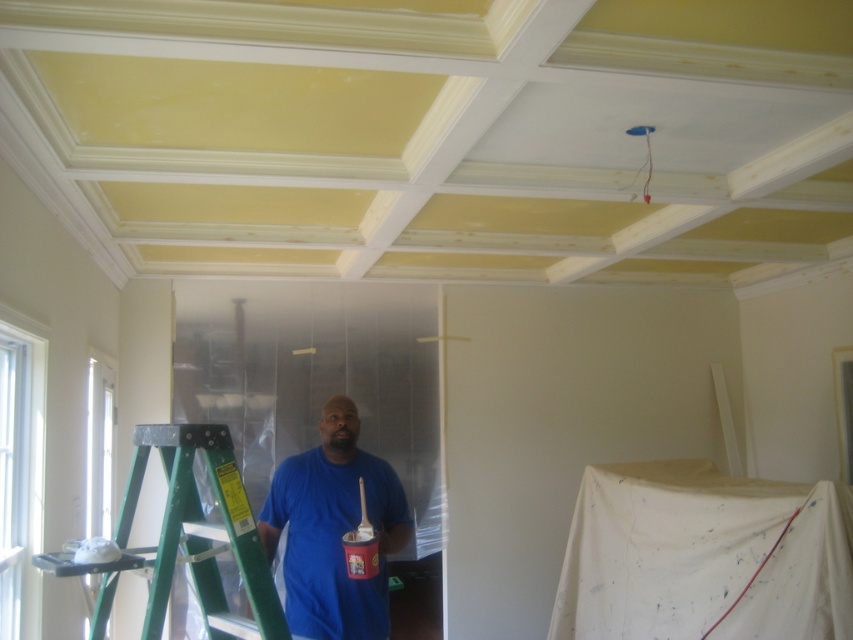
Is blue cotton shirt at center to the left of green metallic ladder at center from the viewer's perspective?

In fact, blue cotton shirt at center is to the right of green metallic ladder at center.

Which is behind, point (335, 634) or point (131, 515)?

The point (335, 634) is behind.

This screenshot has width=853, height=640. Find the location of `blue cotton shirt at center`. blue cotton shirt at center is located at coordinates (334, 529).